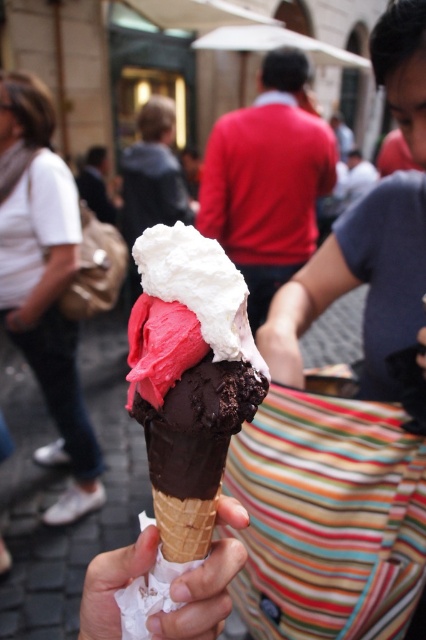
Is point (141, 273) positioned behind point (37, 179)?

That is False.

Who is shorter, chocolate-frosted ice cream cone at center or white fabric purse at lower left?

With less height is chocolate-frosted ice cream cone at center.

Does point (178, 316) come in front of point (57, 401)?

Yes, it is in front of point (57, 401).

In order to click on chocolate-frosted ice cream cone at center in this screenshot , I will do `click(189, 374)`.

Who is more forward, (213,304) or (209,616)?

Point (213,304)

Is chocolate-frosted ice cream cone at center smaller than white paper at center?

Incorrect, chocolate-frosted ice cream cone at center is not smaller in size than white paper at center.

The image size is (426, 640). Find the location of `chocolate-frosted ice cream cone at center`. chocolate-frosted ice cream cone at center is located at coordinates tap(189, 374).

Which is behind, point (58, 163) or point (109, 579)?

The point (58, 163) is behind.

Who is more forward, (48, 196) or (140, 572)?

Point (140, 572) is more forward.

Where is `white fabric purse at lower left`? The height and width of the screenshot is (640, 426). white fabric purse at lower left is located at coordinates (43, 282).

The width and height of the screenshot is (426, 640). In order to click on white fabric purse at lower left in this screenshot , I will do `click(43, 282)`.